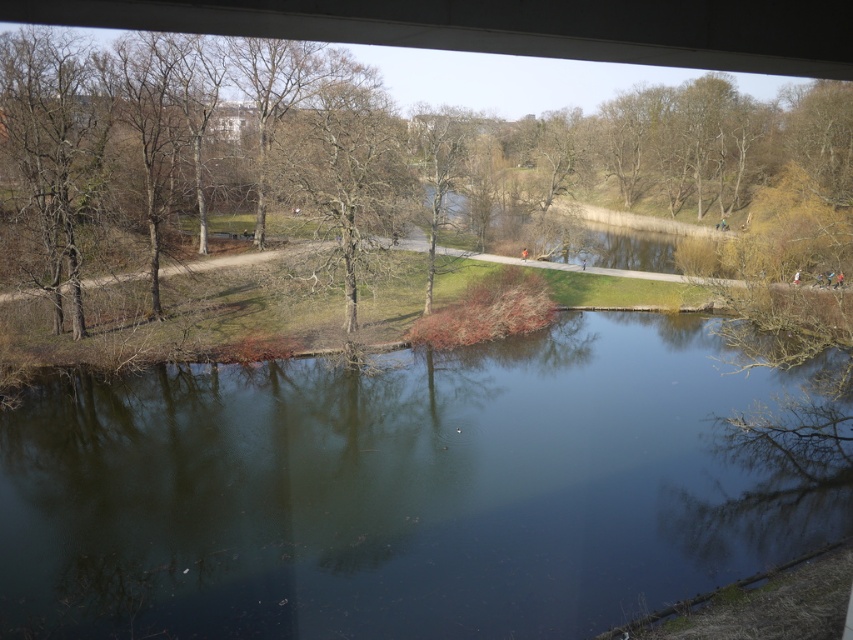
Looking at this image, does dark blue water at center have a greater height compared to bare branches at center?

No.

Locate an element on the screen. dark blue water at center is located at coordinates (410, 490).

Is point (692, 552) positioned in front of point (311, 269)?

Yes, it is.

You are a GUI agent. You are given a task and a screenshot of the screen. Output one action in this format:
    pyautogui.click(x=<x>, y=<y>)
    Task: Click on the dark blue water at center
    This screenshot has height=640, width=853.
    Given the screenshot: What is the action you would take?
    pyautogui.click(x=410, y=490)

Between dark blue water at center and brown leafless tree at lower left, which one is positioned higher?

brown leafless tree at lower left is above.

Does point (671, 492) come closer to viewer compared to point (242, 49)?

Yes, point (671, 492) is in front of point (242, 49).

Who is more distant from viewer, (703, 461) or (566, 192)?

Positioned behind is point (566, 192).

Locate an element on the screen. dark blue water at center is located at coordinates (410, 490).

Can you confirm if brown leafless tree at lower left is thinner than bare branches at center?

Incorrect, brown leafless tree at lower left's width is not less than bare branches at center's.

Who is more forward, [701,86] or [374,232]?

Point [374,232] is more forward.

What do you see at coordinates (697, 145) in the screenshot?
I see `brown leafless tree at lower left` at bounding box center [697, 145].

This screenshot has width=853, height=640. Find the location of `brown leafless tree at lower left`. brown leafless tree at lower left is located at coordinates tap(697, 145).